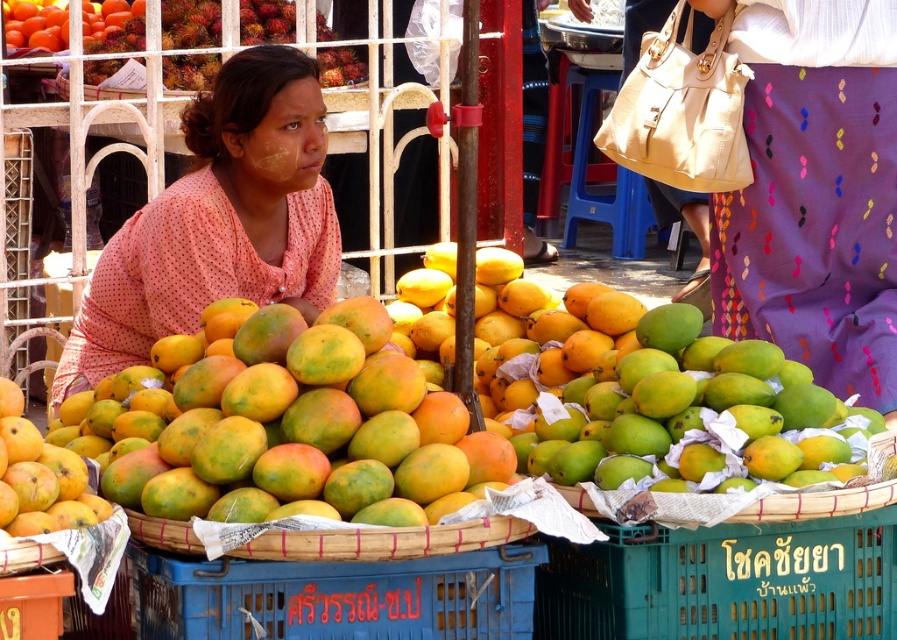
Between point (250, 618) and point (16, 474), which one is positioned behind?

The point (250, 618) is more distant.

Which is in front, point (337, 620) or point (48, 524)?

Point (48, 524) is more forward.

In order to click on blue plastic crate at lower center in this screenshot , I will do `click(337, 596)`.

Is green matte mangoes at center to the left of blue plastic crate at lower center from the viewer's perspective?

Incorrect, green matte mangoes at center is not on the left side of blue plastic crate at lower center.

Between point (706, 381) and point (150, 552), which one is positioned behind?

Point (706, 381)

You are a GUI agent. You are given a task and a screenshot of the screen. Output one action in this format:
    pyautogui.click(x=<x>, y=<y>)
    Task: Click on the green matte mangoes at center
    
    Given the screenshot: What is the action you would take?
    pyautogui.click(x=686, y=410)

How distant is green matte mangoes at center from ruddy textured rambutan at upper center?

38.52 feet

In the scene shown: Between green matte mangoes at center and ruddy textured rambutan at upper center, which one has more height?

green matte mangoes at center

Is point (684, 392) farther from viewer compared to point (260, 16)?

No.

At what (x,y) coordinates should I click in order to perform the action: click on green matte mangoes at center. Please return your answer as a coordinate pair (x, y). Looking at the image, I should click on (686, 410).